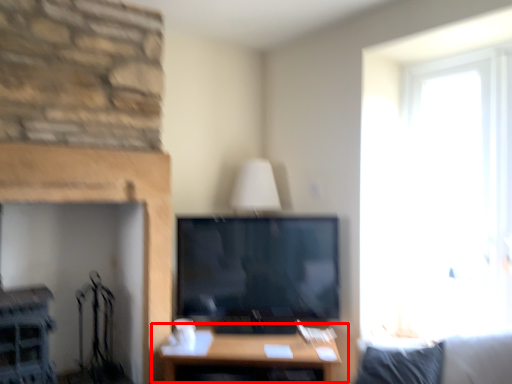
Question: From the image's perspective, what is the correct spatial relationship of table (annotated by the red box) in relation to fireplace?

Choices:
 (A) above
 (B) below

Answer: (B)